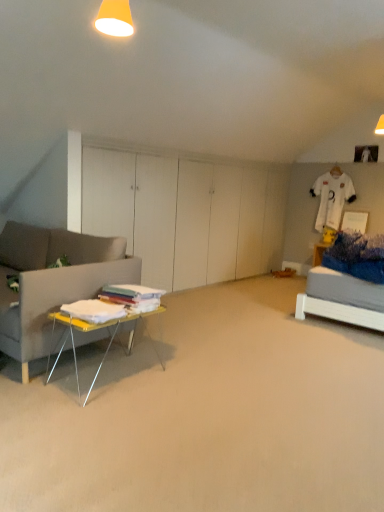
Where is `free space in front of yellow metallic table at lower left`? The width and height of the screenshot is (384, 512). free space in front of yellow metallic table at lower left is located at coordinates (104, 417).